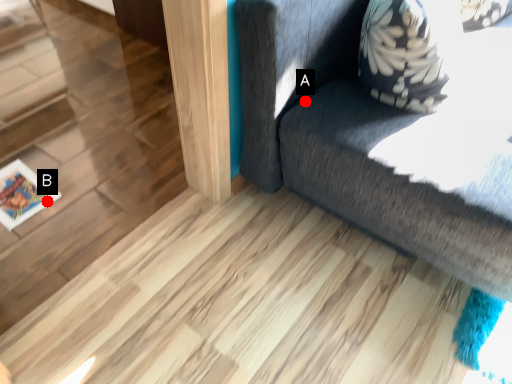
Question: Two points are circled on the image, labeled by A and B beside each circle. Which point is further to the camera?

Choices:
 (A) A is further
 (B) B is further

Answer: (B)